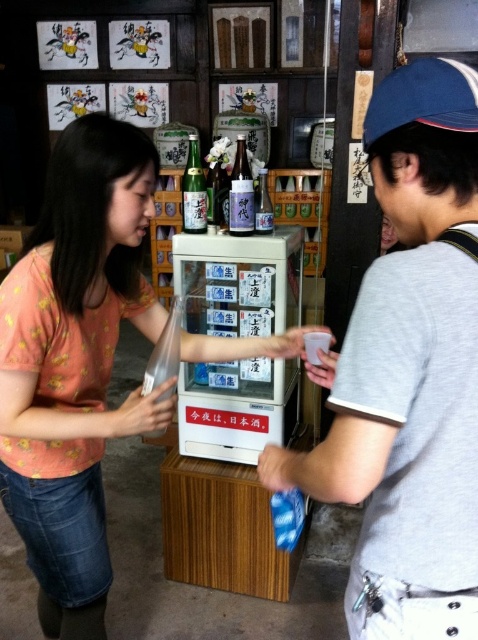
You are a customer in this shop and you want to place an order. The shop has a rule that if an object is taller than another object in the scene, you must mention its name first in your order. Which object should you mention first in your order between the blue fabric baseball cap at upper right and the matte glass bottle at center?

The matte glass bottle at center is taller than the blue fabric baseball cap at upper right, so you should mention the matte glass bottle at center first in your order.

You are a delivery person who needs to place a matte glass bottle at center on a shelf that is 1.1 meters away from the blue fabric baseball cap at upper right. Can you safely place the bottle on the shelf without moving the cap?

The blue fabric baseball cap at upper right is 1.04 meters away from matte glass bottle at center. Since the shelf needs to be 1.1 meters away from the cap, there is enough space to place the bottle on the shelf without moving the cap.

You are a customer at this Japanese bar and see the two bottles, the matte glass bottle at center and the matte purple glass bottle at center. Which one is located to the left?

The matte glass bottle at center is positioned on the left side of the matte purple glass bottle at center, so it is located to the left.